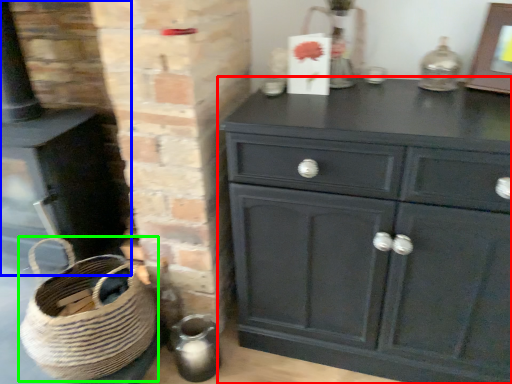
Question: Considering the real-world distances, which object is closest to chest of drawers (highlighted by a red box)? fireplace (highlighted by a blue box) or basket (highlighted by a green box).

Choices:
 (A) fireplace
 (B) basket

Answer: (B)